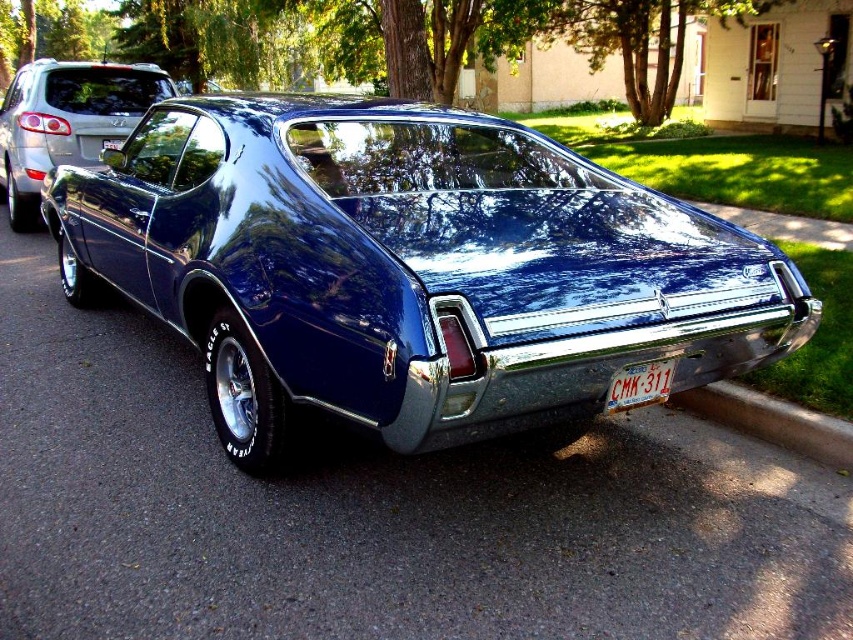
You are standing at the intersection of two streets and see the glossy blue car at center. If you were to draw a straight line from your current position to the car, what would be the coordinates of the point where this line intersects the car?

The coordinates of the point where the line intersects the glossy blue car at center would be at its 2D location, which is at point (409, 268).

You are a delivery person with a 1.2 meter wide cart. You need to park your cart between the glossy blue car at center and the gray concrete curb at lower right. Is there enough space for your cart to fit?

The glossy blue car at center is 1.50 meters away from the gray concrete curb at lower right. Since the cart is 1.2 meters wide, there is sufficient space for the cart to fit between them.